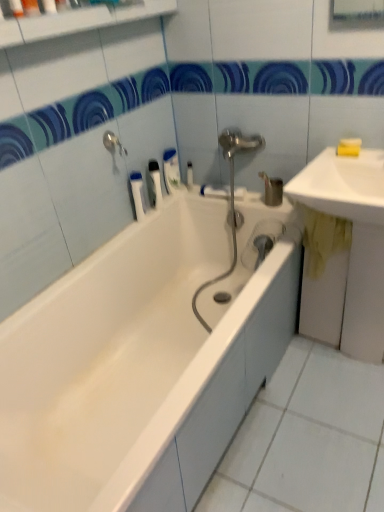
The height and width of the screenshot is (512, 384). What do you see at coordinates (154, 183) in the screenshot?
I see `white plastic toothbrush at upper center, the 2th toiletry from the bottom` at bounding box center [154, 183].

What is the approximate height of white plastic toothbrush at upper center, the 3th toiletry in the front-to-back sequence?

It is 8.87 inches.

Measure the distance between yellow fabric at right, the second sink positioned from the top, and camera.

yellow fabric at right, the second sink positioned from the top, and camera are 1.24 meters apart.

In the scene shown: In order to face yellow matte soap at upper right, the second soap viewed from the top, should I rotate leftwards or rightwards?

You should rotate right by 20.424 degrees.

What do you see at coordinates (349, 147) in the screenshot? I see `yellow matte soap at upper right, which is counted as the first soap, starting from the bottom` at bounding box center [349, 147].

You are a GUI agent. You are given a task and a screenshot of the screen. Output one action in this format:
    pyautogui.click(x=<x>, y=<y>)
    Task: Click on the white glossy bathtub at center
    This screenshot has width=384, height=512.
    Given the screenshot: What is the action you would take?
    pyautogui.click(x=144, y=360)

Can you tell me how much silver metallic tap at upper left and yellow matte bar of soap at upper right, which is the 1th soap in top-to-bottom order, differ in facing direction?

60.8 degrees.

From a real-world perspective, does silver metallic tap at upper left sit lower than yellow matte bar of soap at upper right, which is the 1th soap in top-to-bottom order?

No, from a real-world perspective, silver metallic tap at upper left is not beneath yellow matte bar of soap at upper right, which is the 1th soap in top-to-bottom order.

Is silver metallic tap at upper left spatially inside yellow matte bar of soap at upper right, which is counted as the 2th soap, starting from the bottom, or outside of it?

silver metallic tap at upper left is not inside yellow matte bar of soap at upper right, which is counted as the 2th soap, starting from the bottom, it's outside.

Can you confirm if white glossy sink at upper right, arranged as the 2th sink when ordered from the bottom, is bigger than white glossy bathtub at center?

Actually, white glossy sink at upper right, arranged as the 2th sink when ordered from the bottom, might be smaller than white glossy bathtub at center.

Is white glossy sink at upper right, arranged as the 2th sink when ordered from the bottom, completely or partially outside of white glossy bathtub at center?

That's correct, white glossy sink at upper right, arranged as the 2th sink when ordered from the bottom, is outside of white glossy bathtub at center.

In the scene shown: Is white glossy sink at upper right, the 1th sink in the top-to-bottom sequence, shorter than white glossy bathtub at center?

Correct, white glossy sink at upper right, the 1th sink in the top-to-bottom sequence, is not as tall as white glossy bathtub at center.

Is yellow fabric at right, acting as the first sink starting from the bottom, inside or outside of silver metallic tap at upper left?

yellow fabric at right, acting as the first sink starting from the bottom, is not inside silver metallic tap at upper left, it's outside.

Starting from the silver metallic tap at upper left, which sink is the 2nd one to the right? Please provide its 2D coordinates.

[(346, 253)]

Which is more to the left, yellow fabric at right, the second sink positioned from the top, or silver metallic tap at upper left?

silver metallic tap at upper left.

From the image's perspective, would you say yellow matte soap at upper right, the second soap viewed from the top, is positioned over silver metallic tap at upper left?

No, from the image's perspective, yellow matte soap at upper right, the second soap viewed from the top, is not above silver metallic tap at upper left.

Is yellow matte soap at upper right, the second soap viewed from the top, with silver metallic tap at upper left?

No, yellow matte soap at upper right, the second soap viewed from the top, is not with silver metallic tap at upper left.

Is silver metallic tap at upper left at the back of yellow matte soap at upper right, which is counted as the first soap, starting from the bottom?

No, silver metallic tap at upper left is not at the back of yellow matte soap at upper right, which is counted as the first soap, starting from the bottom.

Is point (349, 145) farther from camera compared to point (107, 132)?

No.

From the image's perspective, which one is positioned lower, matte orange soap at upper left, which is counted as the first toiletry, starting from the front, or white glossy sink at upper right, arranged as the 2th sink when ordered from the bottom?

white glossy sink at upper right, arranged as the 2th sink when ordered from the bottom, from the image's perspective.

Considering the points (24, 2) and (357, 218), which point is in front, point (24, 2) or point (357, 218)?

The point (24, 2) is closer.

Which is correct: matte orange soap at upper left, which is the fourth toiletry in back-to-front order, is inside white glossy sink at upper right, the 1th sink in the top-to-bottom sequence, or outside of it?

matte orange soap at upper left, which is the fourth toiletry in back-to-front order, is located beyond the bounds of white glossy sink at upper right, the 1th sink in the top-to-bottom sequence.

From a real-world perspective, who is located higher, matte orange soap at upper left, which is counted as the 1th toiletry, starting from the top, or white glossy sink at upper right, arranged as the 2th sink when ordered from the bottom?

Result: In real-world perspective, matte orange soap at upper left, which is counted as the 1th toiletry, starting from the top, is above.

Which of these two, yellow matte bar of soap at upper right, which is the 1th soap in top-to-bottom order, or white glossy sink at upper right, the 1th sink in the top-to-bottom sequence, is thinner?

yellow matte bar of soap at upper right, which is the 1th soap in top-to-bottom order.

Which object is positioned more to the right, yellow matte bar of soap at upper right, which is the 1th soap in top-to-bottom order, or white glossy sink at upper right, arranged as the 2th sink when ordered from the bottom?

Positioned to the right is yellow matte bar of soap at upper right, which is the 1th soap in top-to-bottom order.

From the image's perspective, would you say yellow matte bar of soap at upper right, which is the 1th soap in top-to-bottom order, is shown under white glossy sink at upper right, arranged as the 2th sink when ordered from the bottom?

No.

In the scene shown: In terms of height, does yellow matte bar of soap at upper right, which is the 1th soap in top-to-bottom order, look taller or shorter compared to white glossy sink at upper right, arranged as the 2th sink when ordered from the bottom?

In the image, yellow matte bar of soap at upper right, which is the 1th soap in top-to-bottom order, appears to be shorter than white glossy sink at upper right, arranged as the 2th sink when ordered from the bottom.

Can you confirm if white plastic bottle at upper center, which ranks as the 1th toiletry in back-to-front order, is smaller than white glossy bathtub at center?

Indeed, white plastic bottle at upper center, which ranks as the 1th toiletry in back-to-front order, has a smaller size compared to white glossy bathtub at center.

Based on the photo, how different are the orientations of white plastic bottle at upper center, marked as the 2th toiletry in a top-to-bottom arrangement, and white glossy bathtub at center in degrees?

90 degrees.

Does point (191, 182) lie in front of point (247, 280)?

No, (191, 182) is behind (247, 280).

Is white plastic bottle at upper center, which is the 1th toiletry from right to left, looking in the opposite direction of white glossy bathtub at center?

No.

There is a silver metallic tap at upper left. In order to click on the 1st soap below it (from a real-world perspective) in this screenshot , I will do `click(350, 142)`.

The image size is (384, 512). I want to click on sink that is the 1st object to the right of the white glossy bathtub at center, starting at the anchor, so click(x=343, y=185).

Based on their spatial positions, is matte orange soap at upper left, acting as the 4th toiletry starting from the bottom, or white plastic tube at upper center, marked as the 3th toiletry in a right-to-left arrangement, further from white plastic toothbrush at upper center, the 3th toiletry in the front-to-back sequence?

Among the two, matte orange soap at upper left, acting as the 4th toiletry starting from the bottom, is located further to white plastic toothbrush at upper center, the 3th toiletry in the front-to-back sequence.

From the image, which object appears to be farther from yellow matte bar of soap at upper right, which is the 1th soap in top-to-bottom order, silver metallic tap at upper left or white plastic bottle at upper center, the 4th toiletry positioned from the front?

The object further to yellow matte bar of soap at upper right, which is the 1th soap in top-to-bottom order, is silver metallic tap at upper left.

When comparing their distances from white plastic bottle at upper center, the 4th toiletry positioned from the front, does white glossy bathtub at center or white plastic tube at upper center, the 4th toiletry in the top-to-bottom sequence, seem closer?

Among the two, white plastic tube at upper center, the 4th toiletry in the top-to-bottom sequence, is located nearer to white plastic bottle at upper center, the 4th toiletry positioned from the front.

Considering their positions, is silver metallic tap at upper left positioned further to yellow matte bar of soap at upper right, which is the 1th soap in top-to-bottom order, than yellow matte soap at upper right, the second soap viewed from the top?

silver metallic tap at upper left lies further to yellow matte bar of soap at upper right, which is the 1th soap in top-to-bottom order, than the other object.

Estimate the real-world distances between objects in this image. Which object is closer to yellow matte soap at upper right, the second soap viewed from the top, matte orange soap at upper left, which is the fourth toiletry in back-to-front order, or white glossy bathtub at center?

white glossy bathtub at center is closer to yellow matte soap at upper right, the second soap viewed from the top.

Looking at the image, which one is located closer to yellow matte bar of soap at upper right, which is counted as the 2th soap, starting from the bottom, white glossy sink at upper right, arranged as the 2th sink when ordered from the bottom, or yellow fabric at right, acting as the first sink starting from the bottom?

white glossy sink at upper right, arranged as the 2th sink when ordered from the bottom, is closer to yellow matte bar of soap at upper right, which is counted as the 2th soap, starting from the bottom.

Which object lies nearer to the anchor point yellow matte soap at upper right, which is counted as the first soap, starting from the bottom, yellow fabric at right, the second sink positioned from the top, or silver metallic tap at upper left?

yellow fabric at right, the second sink positioned from the top, lies closer to yellow matte soap at upper right, which is counted as the first soap, starting from the bottom, than the other object.

Looking at the image, which one is located further to yellow matte soap at upper right, the second soap viewed from the top, white plastic bottle at upper center, the 4th toiletry when ordered from left to right, or white plastic toothbrush at upper center, the 3th toiletry in the front-to-back sequence?

Based on the image, white plastic toothbrush at upper center, the 3th toiletry in the front-to-back sequence, appears to be further to yellow matte soap at upper right, the second soap viewed from the top.

Locate an element on the screen. toiletry between white plastic toothbrush at upper center, the 2th toiletry when ordered from right to left, and yellow matte soap at upper right, which is counted as the first soap, starting from the bottom is located at coordinates [189, 175].

Where is `soap between yellow matte bar of soap at upper right, which is the 1th soap in top-to-bottom order, and yellow fabric at right, the second sink positioned from the top, in the vertical direction`? soap between yellow matte bar of soap at upper right, which is the 1th soap in top-to-bottom order, and yellow fabric at right, the second sink positioned from the top, in the vertical direction is located at coordinates (349, 147).

Locate an element on the screen. This screenshot has height=512, width=384. sink between silver metallic tap at upper left and yellow fabric at right, the second sink positioned from the top is located at coordinates (343, 185).

Locate an element on the screen. sink located between white plastic tube at upper center, the 4th toiletry in the top-to-bottom sequence, and yellow matte bar of soap at upper right, which is counted as the 2th soap, starting from the bottom, in the left-right direction is located at coordinates (343, 185).